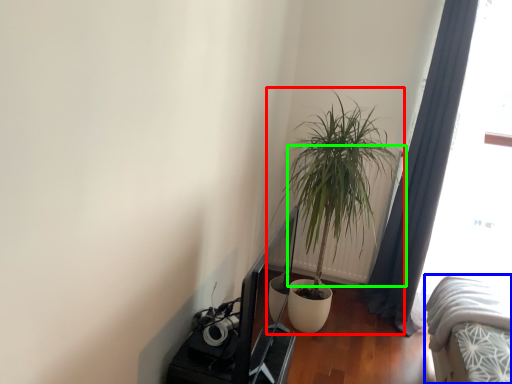
Question: Which is farther away from houseplant (highlighted by a red box)? bed (highlighted by a blue box) or radiator (highlighted by a green box)?

Choices:
 (A) bed
 (B) radiator

Answer: (A)